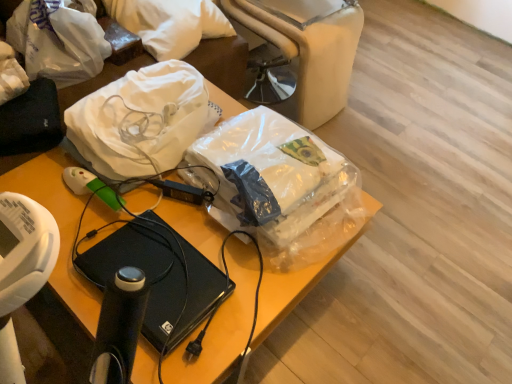
In order to click on vacant space behind black matte laptop at center in this screenshot , I will do `click(182, 211)`.